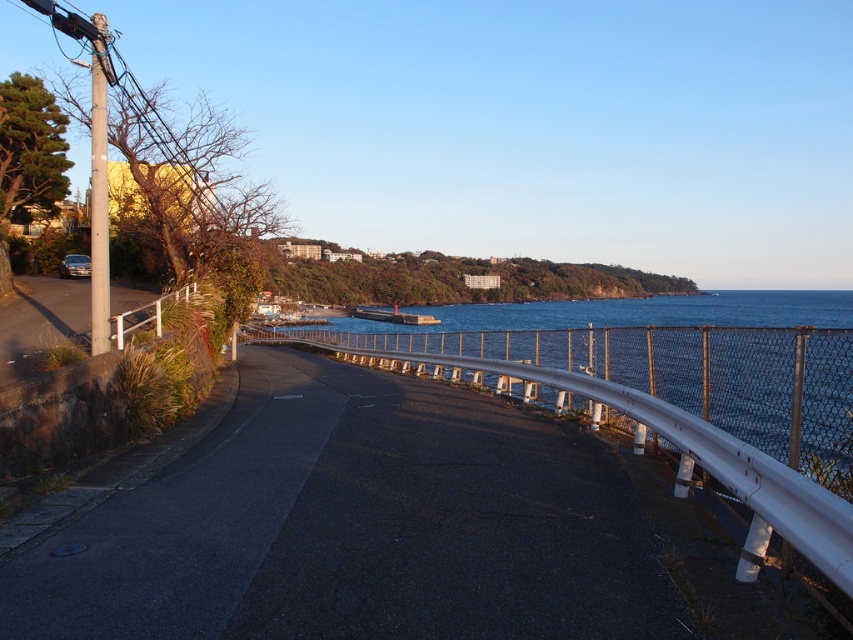
Is white metallic rail at center-right positioned before smooth gray pole at left?

Yes.

Does white metallic rail at center-right have a larger size compared to smooth gray pole at left?

No, white metallic rail at center-right is not bigger than smooth gray pole at left.

I want to click on white metallic rail at center-right, so click(685, 452).

Where is `white metallic rail at center-right`? The image size is (853, 640). white metallic rail at center-right is located at coordinates (685, 452).

Is point (764, 412) positioned before point (660, 433)?

Yes, point (764, 412) is in front of point (660, 433).

In the scene shown: Can you confirm if metallic chain-link fence at center is wider than white metallic rail at center-right?

Correct, the width of metallic chain-link fence at center exceeds that of white metallic rail at center-right.

This screenshot has height=640, width=853. What do you see at coordinates (682, 362) in the screenshot?
I see `metallic chain-link fence at center` at bounding box center [682, 362].

At what (x,y) coordinates should I click in order to perform the action: click on metallic chain-link fence at center. Please return your answer as a coordinate pair (x, y). This screenshot has width=853, height=640. Looking at the image, I should click on (682, 362).

Is point (459, 477) more distant than point (107, 344)?

That is False.

Is point (201, 476) farther from viewer compared to point (91, 301)?

No.

The image size is (853, 640). In order to click on black asphalt road at center in this screenshot , I will do `click(357, 525)`.